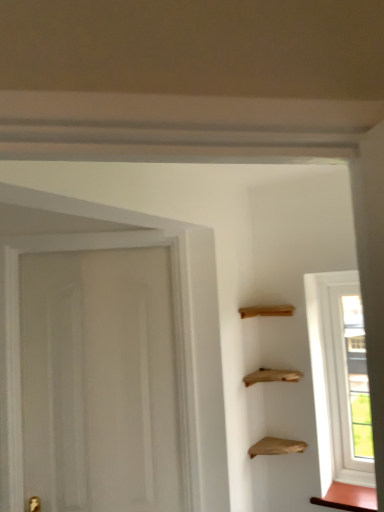
Question: Does matte brown cabinet at lower right, which is the 1th cabinetry in bottom-to-top order, have a greater height compared to wooden shelves at upper right, which appears as the first cabinetry when viewed from the top?

Choices:
 (A) no
 (B) yes

Answer: (A)

Question: Considering the relative sizes of matte brown cabinet at lower right, which ranks as the 2th cabinetry in left-to-right order, and wooden shelves at upper right, arranged as the 2th cabinetry when viewed from the right, in the image provided, is matte brown cabinet at lower right, which ranks as the 2th cabinetry in left-to-right order, wider than wooden shelves at upper right, arranged as the 2th cabinetry when viewed from the right,?

Choices:
 (A) no
 (B) yes

Answer: (B)

Question: Is wooden shelves at upper right, the 1th cabinetry when ordered from left to right, at the back of matte brown cabinet at lower right, which is the 1th cabinetry in bottom-to-top order?

Choices:
 (A) yes
 (B) no

Answer: (B)

Question: Is matte brown cabinet at lower right, marked as the first cabinetry in a right-to-left arrangement, positioned beyond the bounds of wooden shelves at upper right, which appears as the first cabinetry when viewed from the top?

Choices:
 (A) yes
 (B) no

Answer: (A)

Question: Does matte brown cabinet at lower right, which ranks as the 2th cabinetry in left-to-right order, come behind wooden shelves at upper right, which appears as the second cabinetry when ordered from the bottom?

Choices:
 (A) no
 (B) yes

Answer: (B)

Question: Considering the positions of point tap(350, 492) and point tap(256, 504), is point tap(350, 492) closer or farther from the camera than point tap(256, 504)?

Choices:
 (A) closer
 (B) farther

Answer: (A)

Question: In terms of height, does matte brown cabinet at lower right, marked as the first cabinetry in a right-to-left arrangement, look taller or shorter compared to wooden shelves at upper right, arranged as the 2th cabinetry when viewed from the right?

Choices:
 (A) short
 (B) tall

Answer: (A)

Question: Considering the positions of matte brown cabinet at lower right, marked as the first cabinetry in a right-to-left arrangement, and wooden shelves at upper right, which appears as the second cabinetry when ordered from the bottom, in the image, is matte brown cabinet at lower right, marked as the first cabinetry in a right-to-left arrangement, bigger or smaller than wooden shelves at upper right, which appears as the second cabinetry when ordered from the bottom,?

Choices:
 (A) small
 (B) big

Answer: (A)

Question: Is matte brown cabinet at lower right, marked as the first cabinetry in a right-to-left arrangement, in front of or behind wooden shelves at upper right, the 1th cabinetry when ordered from left to right, in the image?

Choices:
 (A) behind
 (B) front

Answer: (A)

Question: Is transparent glass window at right spatially inside wooden shelves at upper right, arranged as the 2th cabinetry when viewed from the right, or outside of it?

Choices:
 (A) inside
 (B) outside

Answer: (B)

Question: Does point (321, 387) appear closer or farther from the camera than point (281, 389)?

Choices:
 (A) closer
 (B) farther

Answer: (B)

Question: From a real-world perspective, is transparent glass window at right positioned above or below wooden shelves at upper right, which appears as the second cabinetry when ordered from the bottom?

Choices:
 (A) above
 (B) below

Answer: (B)

Question: Considering their positions, is transparent glass window at right located in front of or behind wooden shelves at upper right, which appears as the second cabinetry when ordered from the bottom?

Choices:
 (A) behind
 (B) front

Answer: (A)

Question: Which is correct: matte brown cabinet at lower right, which ranks as the 2th cabinetry in left-to-right order, is inside transparent glass window at right, or outside of it?

Choices:
 (A) outside
 (B) inside

Answer: (A)

Question: Is point (352, 493) closer or farther from the camera than point (334, 294)?

Choices:
 (A) farther
 (B) closer

Answer: (B)